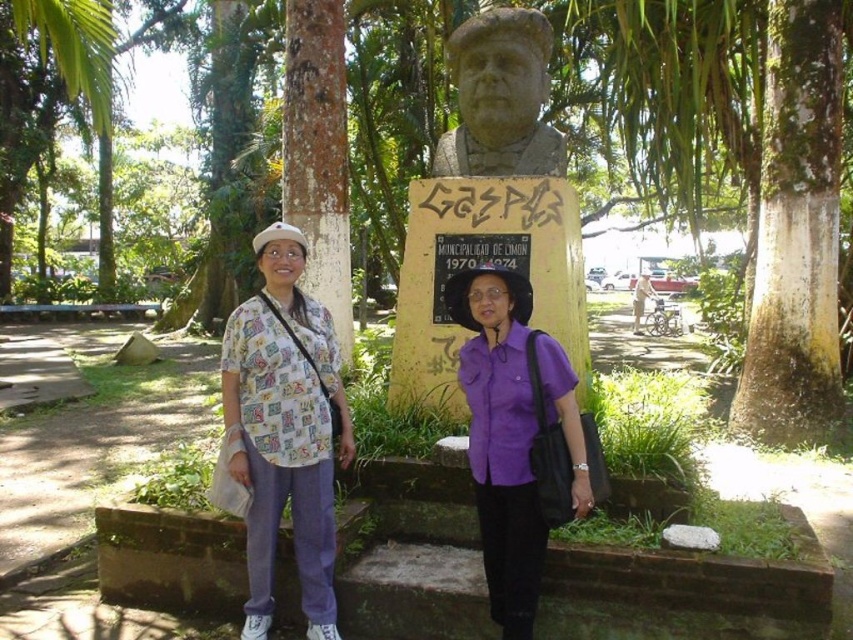
Looking at this image, you are a park visitor standing in front of the statue. You notice a green bark tree at center and a printed cotton shirt at left. Which object is higher up in the scene?

The green bark tree at center is located above the printed cotton shirt at left, so the green bark tree at center is higher up in the scene.

You are a park maintenance worker who needs to place a new bench between the green bark tree at center and the purple matte shirt at center. The bench requires a minimum of 15 feet of space between the two objects to be placed safely. Can you place the bench there?

The green bark tree at center is 16.28 feet from the purple matte shirt at center, which is more than the required 15 feet, so yes, the bench can be placed there safely.

You are a photographer trying to capture both the printed fabric shirt at center and the stone statue at center in a single frame. Since you want the shirt to be clearly visible, which object should you focus on first?

The printed fabric shirt at center is positioned under the stone statue at center, so you should focus on the printed fabric shirt at center first to ensure it is in clear view before the statue blocks it.